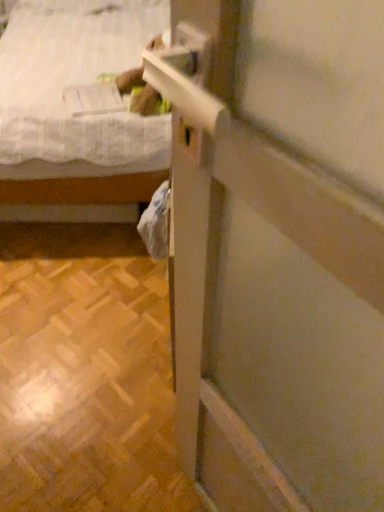
Image resolution: width=384 pixels, height=512 pixels. In order to click on white fabric bed at upper left in this screenshot , I will do [75, 85].

What do you see at coordinates (75, 85) in the screenshot?
I see `white fabric bed at upper left` at bounding box center [75, 85].

The image size is (384, 512). Find the location of `white fabric bed at upper left`. white fabric bed at upper left is located at coordinates (75, 85).